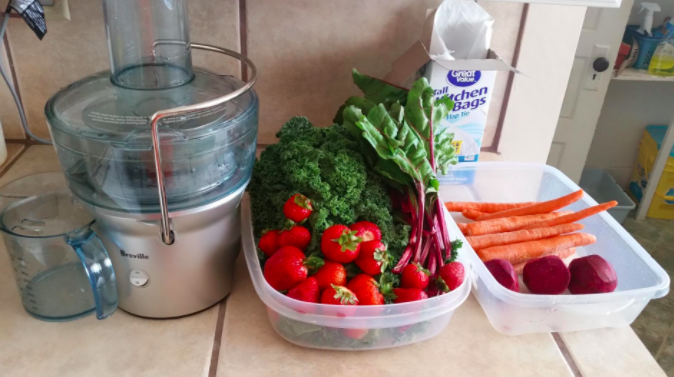
Where is `counter top`? The image size is (674, 377). counter top is located at coordinates (191, 345).